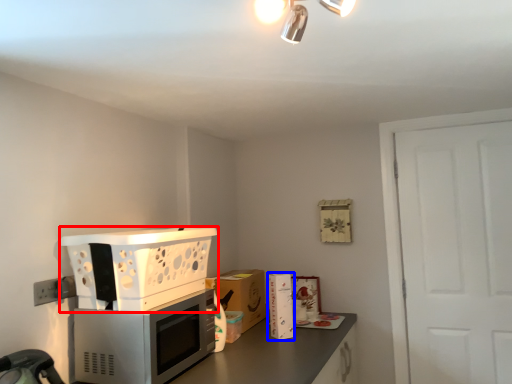
Question: Which of the following is the farthest to the observer, kitchen appliance (highlighted by a red box) or appliance (highlighted by a blue box)?

Choices:
 (A) kitchen appliance
 (B) appliance

Answer: (B)